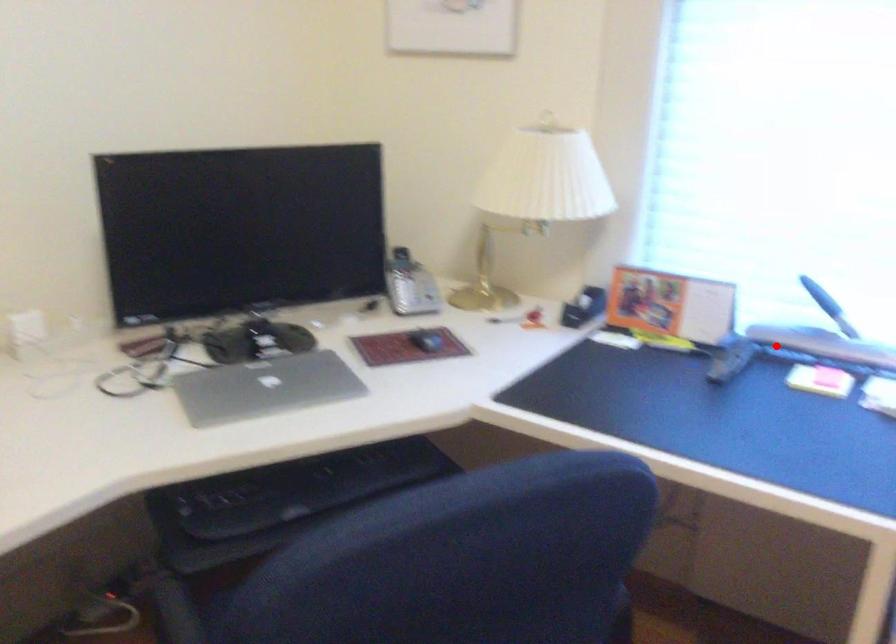
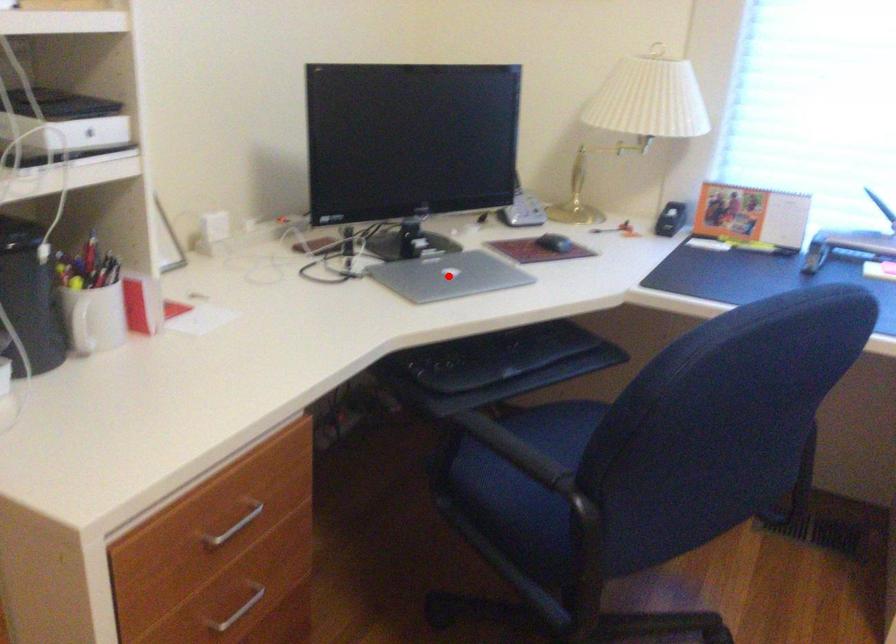
I am providing you with two images of the same scene from different viewpoints. A red point is marked on the first image and another point is marked on the second image. Are the points marked in image1 and image2 representing the same 3D position?

No